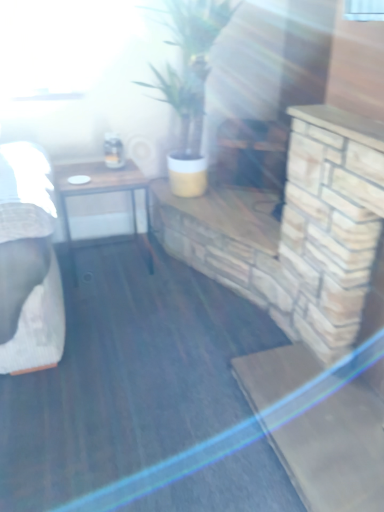
Where is `blank space above wooden table at left (from a real-world perspective)`? This screenshot has width=384, height=512. blank space above wooden table at left (from a real-world perspective) is located at coordinates (102, 177).